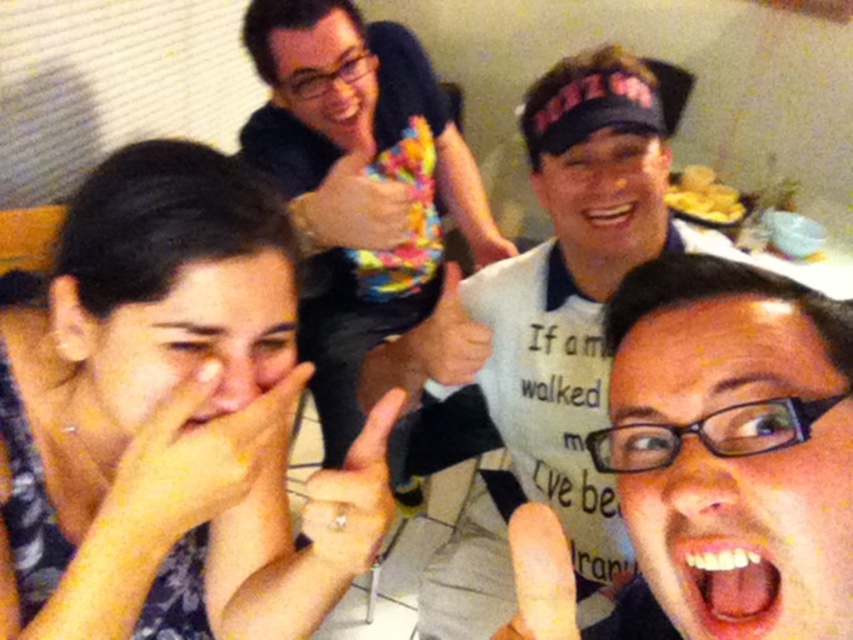
You are trying to decide whether to place a small vase between the floral fabric face at lower left and the multicolored plush toy at upper center. Based on their heights, which object should the vase be placed closer to?

The floral fabric face at lower left has a lesser height compared to the multicolored plush toy at upper center. Therefore, the vase should be placed closer to the floral fabric face at lower left to maintain visual balance.

You are a photographer trying to capture a candid shot of the white cotton shirt at center and the multicolored plush toy at upper center. Which object should you focus on first if you want to include both in the frame without moving the camera?

You should focus on the white cotton shirt at center first because it is shorter than the multicolored plush toy at upper center, so adjusting the framing to include both would require ensuring the taller plush toy is within the frame while the shirt remains visible.

You are a photographer trying to capture a candid shot of the white cotton shirt at center and the multicolored plush toy at upper center. Which object should you focus on first if you want to ensure both are in focus without moving the camera?

The white cotton shirt at center is below the multicolored plush toy at upper center, so you should focus on the multicolored plush toy at upper center first as it is closer to the camera.